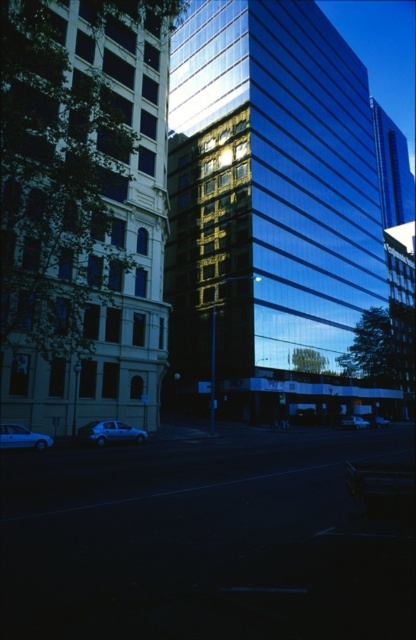
Is glossy glass tower at center to the left of smooth glass building at center from the viewer's perspective?

In fact, glossy glass tower at center is to the right of smooth glass building at center.

Between glossy glass tower at center and smooth glass building at center, which one is positioned higher?

glossy glass tower at center is higher up.

Describe the element at coordinates (272, 209) in the screenshot. I see `glossy glass tower at center` at that location.

You are a GUI agent. You are given a task and a screenshot of the screen. Output one action in this format:
    pyautogui.click(x=<x>, y=<y>)
    Task: Click on the glossy glass tower at center
    
    Given the screenshot: What is the action you would take?
    pyautogui.click(x=272, y=209)

How far apart are silver metallic car at lower left and silver metallic car at center?

silver metallic car at lower left is 96.26 feet away from silver metallic car at center.

Can you confirm if silver metallic car at lower left is thinner than silver metallic car at center?

Correct, silver metallic car at lower left's width is less than silver metallic car at center's.

You are a GUI agent. You are given a task and a screenshot of the screen. Output one action in this format:
    pyautogui.click(x=<x>, y=<y>)
    Task: Click on the silver metallic car at lower left
    
    Given the screenshot: What is the action you would take?
    pyautogui.click(x=109, y=433)

Can you confirm if glossy glass building at upper right is bigger than silver metallic car at lower left?

Yes.

From the picture: Which is below, glossy glass building at upper right or silver metallic car at lower left?

silver metallic car at lower left

Who is more forward, (396, 221) or (99, 428)?

Point (99, 428) is in front.

Where is `glossy glass building at upper right`? The width and height of the screenshot is (416, 640). glossy glass building at upper right is located at coordinates (393, 170).